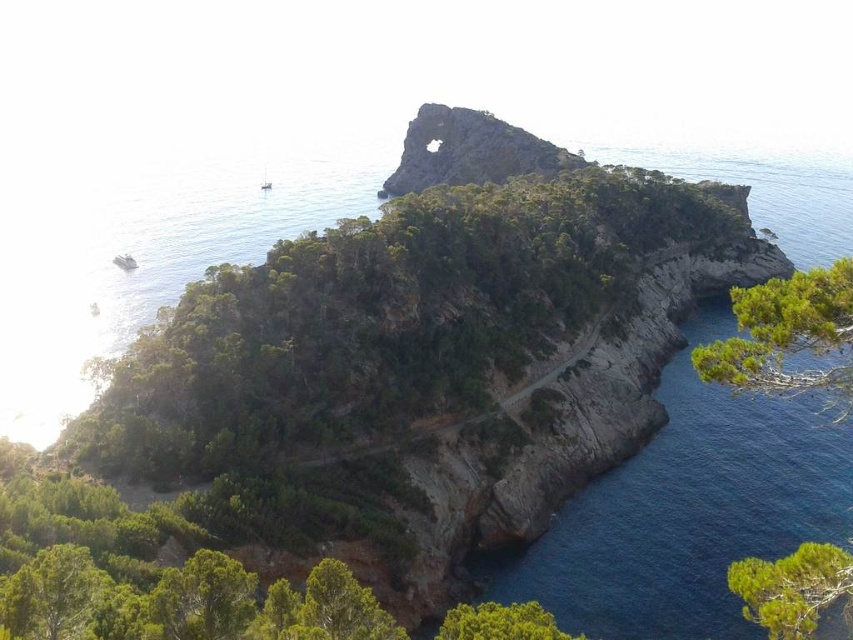
In the scene shown: Is green leafy tree at lower right in front of green leafy tree at lower left?

Yes.

Find the location of a particular element. This screenshot has height=640, width=853. green leafy tree at lower right is located at coordinates (786, 336).

I want to click on green leafy tree at lower right, so click(786, 336).

Does green textured tree at lower right appear under green leafy tree at lower center?

No.

Is point (729, 576) in front of point (486, 608)?

Yes, it is in front of point (486, 608).

Does point (805, 572) lie behind point (514, 634)?

No, (805, 572) is closer to viewer.

Locate an element on the screen. green textured tree at lower right is located at coordinates (793, 588).

Who is shorter, rusty stone arch at upper center or blue smooth water at lower right?

With less height is blue smooth water at lower right.

Who is positioned more to the left, rusty stone arch at upper center or blue smooth water at lower right?

rusty stone arch at upper center is more to the left.

Does point (434, 164) come in front of point (734, 349)?

No, (434, 164) is behind (734, 349).

The height and width of the screenshot is (640, 853). I want to click on rusty stone arch at upper center, so click(x=469, y=150).